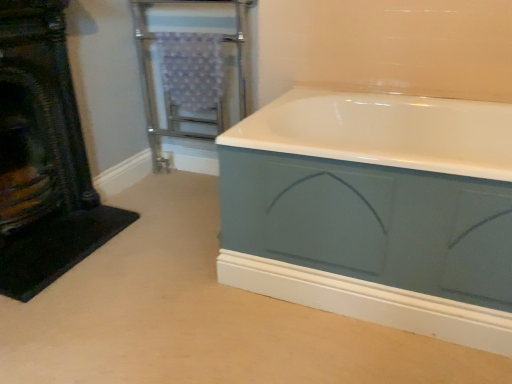
Locate an element on the screen. The width and height of the screenshot is (512, 384). free spot below black textured fireplace at left (from a real-world perspective) is located at coordinates (46, 226).